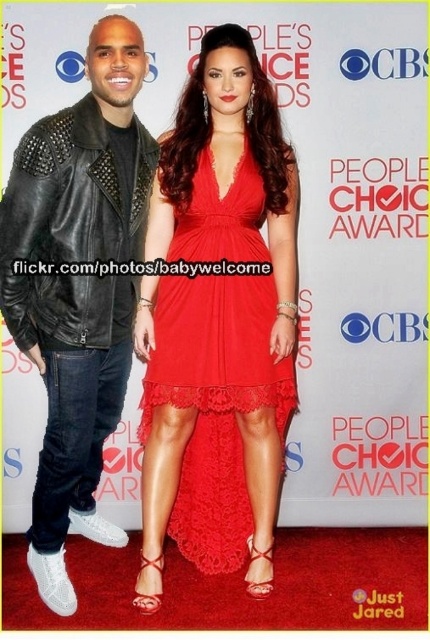
Does point (226, 333) come closer to viewer compared to point (122, 138)?

Yes, it is in front of point (122, 138).

Which of these two, matte red dress at center or black leather jacket at left, stands shorter?

matte red dress at center

Find the location of a particular element. The height and width of the screenshot is (640, 430). matte red dress at center is located at coordinates (218, 323).